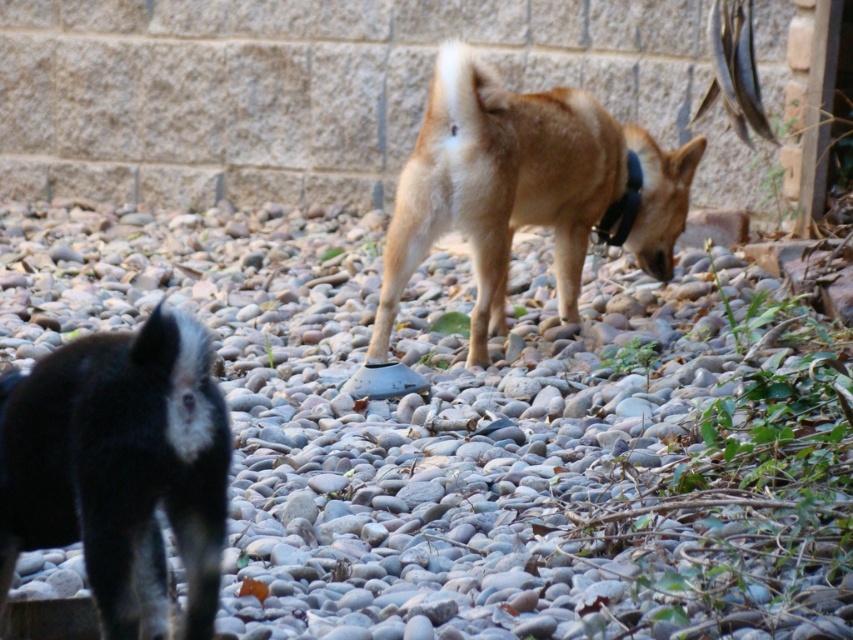
Which is more to the left, light brown fur at center or black fabric neckband at center?

light brown fur at center

Identify the location of light brown fur at center. The width and height of the screenshot is (853, 640). (521, 189).

Is gray pebbles at center closer to camera compared to black fur dog at left?

No, it is not.

Which is more to the right, gray pebbles at center or black fur dog at left?

gray pebbles at center is more to the right.

What do you see at coordinates (482, 433) in the screenshot?
I see `gray pebbles at center` at bounding box center [482, 433].

This screenshot has width=853, height=640. What are the coordinates of `gray pebbles at center` in the screenshot? It's located at (482, 433).

Is gray pebbles at center below black fabric neckband at center?

Yes, gray pebbles at center is below black fabric neckband at center.

Is point (22, 276) positioned after point (610, 237)?

Yes, point (22, 276) is farther from viewer.

Is point (15, 618) behind point (633, 152)?

No, it is in front of (633, 152).

You are a GUI agent. You are given a task and a screenshot of the screen. Output one action in this format:
    pyautogui.click(x=<x>, y=<y>)
    Task: Click on the gray pebbles at center
    This screenshot has width=853, height=640.
    Given the screenshot: What is the action you would take?
    pyautogui.click(x=482, y=433)